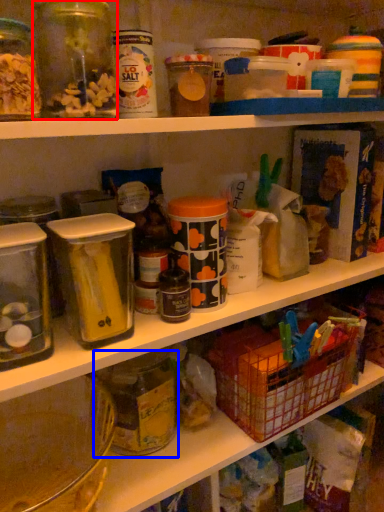
Question: Which of the following is the closest to the observer, glass jar (highlighted by a red box) or glass jar (highlighted by a blue box)?

Choices:
 (A) glass jar
 (B) glass jar

Answer: (A)